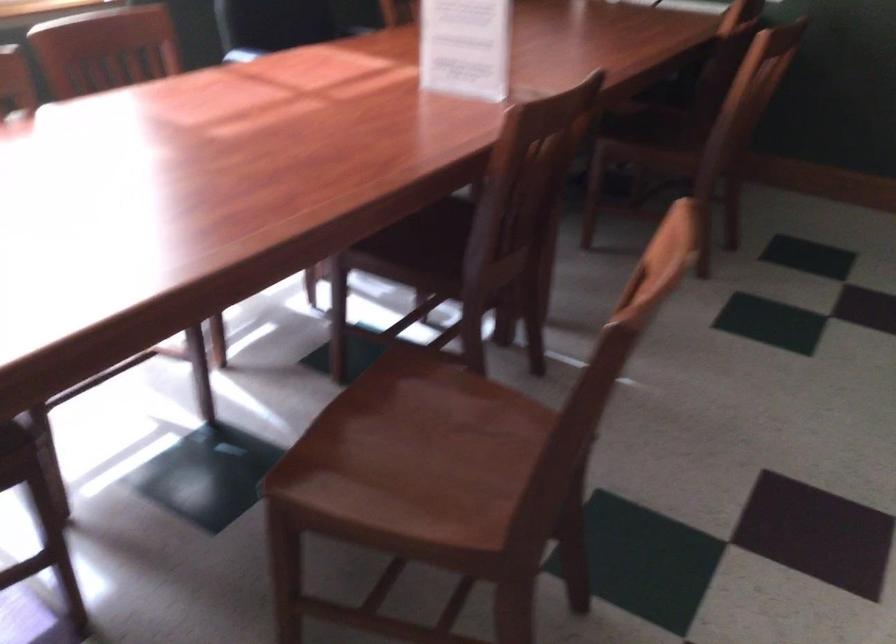
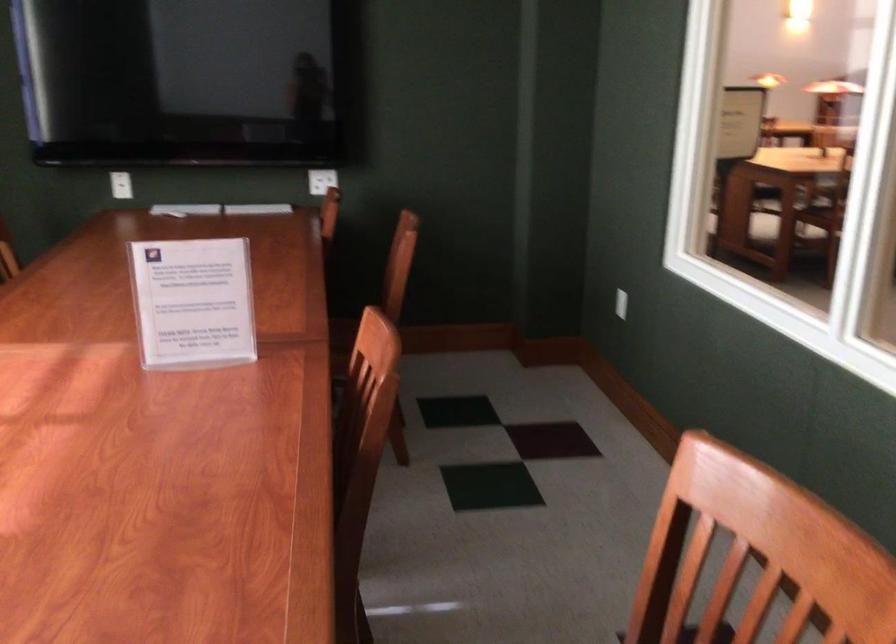
Question: I am providing you with two images of the same scene from different viewpoints. After the viewpoint changes to image2, which objects are now occluded?

Choices:
 (A) acrylic sign holder
 (B) white light switch
 (C) turquoise sitting surface
 (D) chair sitting surface

Answer: (D)